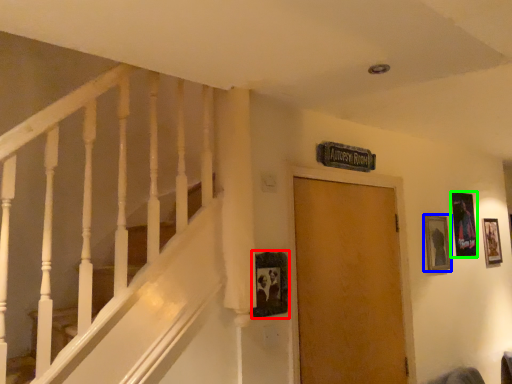
Question: Which object is the farthest from picture frame (highlighted by a red box)? Choose among these: picture frame (highlighted by a blue box) or picture frame (highlighted by a green box).

Choices:
 (A) picture frame
 (B) picture frame

Answer: (B)